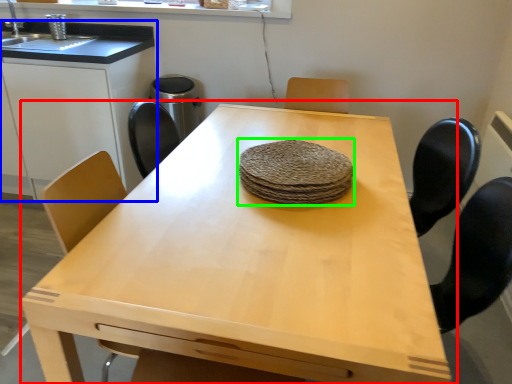
Question: Considering the real-world distances, which object is farthest from table (highlighted by a red box)? cabinetry (highlighted by a blue box) or food (highlighted by a green box)?

Choices:
 (A) cabinetry
 (B) food

Answer: (A)